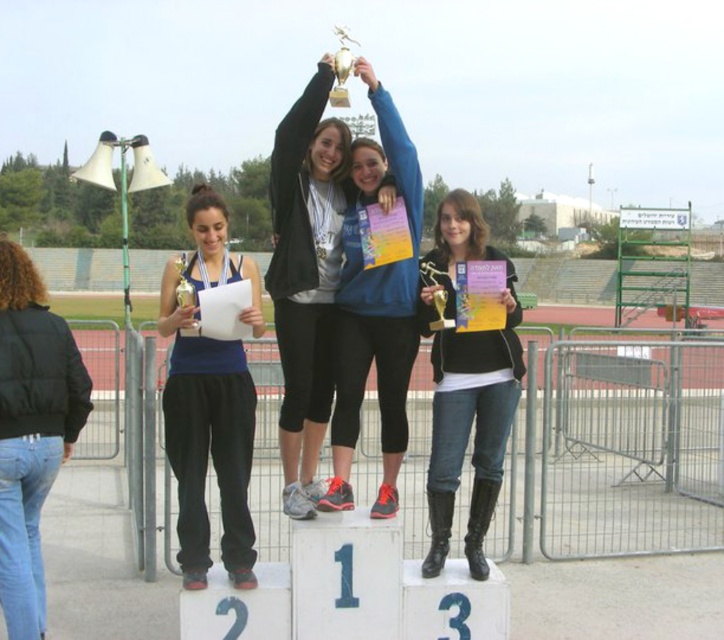
Question: Does matte blue tank top at left have a greater width compared to gold metallic trophy at center?

Choices:
 (A) no
 (B) yes

Answer: (B)

Question: Is matte blue tank top at left bigger than gold metallic trophy at center?

Choices:
 (A) yes
 (B) no

Answer: (A)

Question: Which object is farther from the camera taking this photo?

Choices:
 (A) matte blue tank top at left
 (B) gold metallic trophy at center

Answer: (B)

Question: Among these points, which one is farthest from the camera?

Choices:
 (A) (206, 234)
 (B) (450, 483)
 (C) (445, 316)

Answer: (C)

Question: Which object is farther from the camera taking this photo?

Choices:
 (A) matte black jacket at center
 (B) black puffy jacket at lower left
 (C) matte blue tank top at left

Answer: (A)

Question: Does matte blue tank top at left appear over black leather boots at center?

Choices:
 (A) yes
 (B) no

Answer: (A)